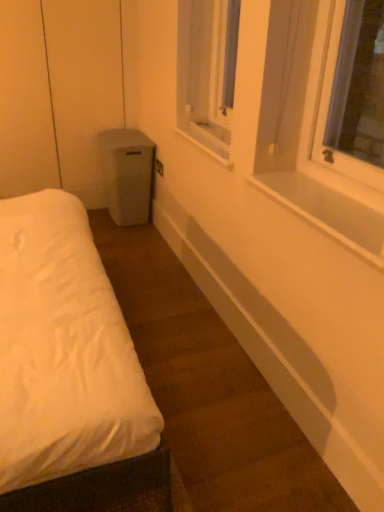
Question: From a real-world perspective, is white plastic window sill at center, placed as the 1th window sill when sorted from back to front, physically located above or below clear plastic window screen at upper center?

Choices:
 (A) above
 (B) below

Answer: (B)

Question: In terms of size, does white plastic window sill at center, the 2th window sill when ordered from bottom to top, appear bigger or smaller than clear plastic window screen at upper center?

Choices:
 (A) big
 (B) small

Answer: (B)

Question: Which of these objects is positioned farthest from the white smooth window sill at upper right, positioned as the second window sill in back-to-front order?

Choices:
 (A) clear plastic window screen at upper center
 (B) white plastic window sill at center, arranged as the first window sill when viewed from the top

Answer: (A)

Question: Estimate the real-world distances between objects in this image. Which object is closer to the white smooth window sill at upper right, positioned as the 1th window sill in bottom-to-top order?

Choices:
 (A) white plastic window sill at center, placed as the 1th window sill when sorted from back to front
 (B) clear plastic window screen at upper center

Answer: (A)